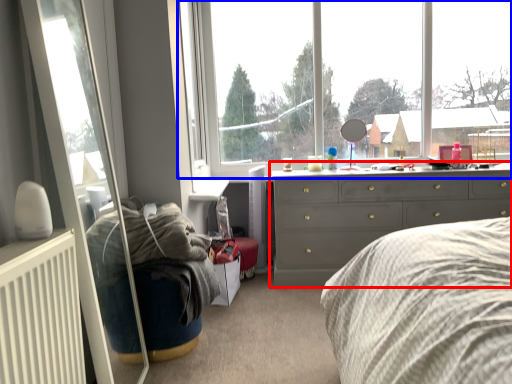
Question: Among these objects, which one is nearest to the camera, chest of drawers (highlighted by a red box) or window (highlighted by a blue box)?

Choices:
 (A) chest of drawers
 (B) window

Answer: (A)